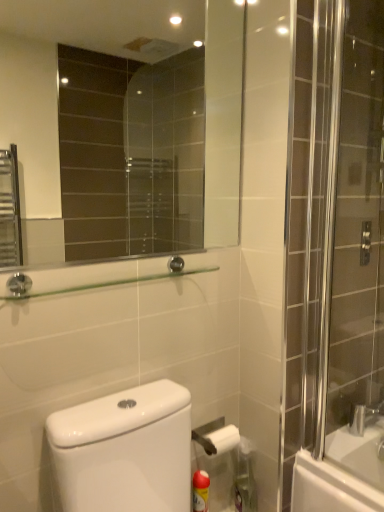
Locate an element on the screen. Image resolution: width=384 pixels, height=512 pixels. clear glass shelf at upper center is located at coordinates (110, 283).

Looking at this image, measure the distance between yellow plastic spray can at lower right, which is counted as the second cleaning product, starting from the left, and camera.

4.53 feet.

Identify the location of clear glass mirror at upper center. The image size is (384, 512). (133, 126).

Considering the sizes of clear glass shower door at right and clear glass mirror at upper center in the image, is clear glass shower door at right bigger or smaller than clear glass mirror at upper center?

A: clear glass shower door at right is bigger than clear glass mirror at upper center.

Considering the relative positions of clear glass shower door at right and clear glass mirror at upper center in the image provided, is clear glass shower door at right to the left or to the right of clear glass mirror at upper center?

In the image, clear glass shower door at right appears on the right side of clear glass mirror at upper center.

Considering the points (349, 44) and (15, 122), which point is behind, point (349, 44) or point (15, 122)?

The point (15, 122) is more distant.

Could you tell me if clear glass shower door at right is turned towards clear glass mirror at upper center?

No, clear glass shower door at right is not oriented towards clear glass mirror at upper center.

You are a GUI agent. You are given a task and a screenshot of the screen. Output one action in this format:
    pyautogui.click(x=<x>, y=<y>)
    Task: Click on the 1st cleaning product positioned below the clear glass shelf at upper center (from the image's perspective)
    The image size is (384, 512).
    Given the screenshot: What is the action you would take?
    pyautogui.click(x=245, y=478)

From the image's perspective, which object appears higher, yellow plastic spray can at lower right, positioned as the 1th cleaning product in right-to-left order, or clear glass shelf at upper center?

clear glass shelf at upper center, from the image's perspective.

Is the surface of yellow plastic spray can at lower right, which is counted as the second cleaning product, starting from the left, in direct contact with clear glass shelf at upper center?

yellow plastic spray can at lower right, which is counted as the second cleaning product, starting from the left, and clear glass shelf at upper center are clearly separated.

Is the position of yellow plastic spray can at lower right, which is counted as the second cleaning product, starting from the left, more distant than that of clear glass shelf at upper center?

Yes, the depth of yellow plastic spray can at lower right, which is counted as the second cleaning product, starting from the left, is greater than that of clear glass shelf at upper center.

Is clear glass mirror at upper center situated inside clear glass shelf at upper center or outside?

clear glass mirror at upper center is spatially situated outside clear glass shelf at upper center.

From the picture: Does clear glass mirror at upper center have a smaller size compared to clear glass shelf at upper center?

Actually, clear glass mirror at upper center might be larger than clear glass shelf at upper center.

Between point (138, 124) and point (8, 295), which one is positioned in front?

Point (8, 295)

Where is `balustrade below the clear glass mirror at upper center (from a real-world perspective)`? Image resolution: width=384 pixels, height=512 pixels. balustrade below the clear glass mirror at upper center (from a real-world perspective) is located at coordinates (110, 283).

From the image's perspective, which is above, clear glass shower door at right or clear glass shelf at upper center?

clear glass shower door at right.

In the scene shown: Looking at the image, does clear glass shower door at right seem bigger or smaller compared to clear glass shelf at upper center?

Considering their sizes, clear glass shower door at right takes up more space than clear glass shelf at upper center.

Is clear glass shower door at right in front of or behind clear glass shelf at upper center in the image?

clear glass shower door at right is behind clear glass shelf at upper center.

Which is behind, point (249, 490) or point (345, 219)?

The point (249, 490) is farther from the camera.

Is yellow plastic spray can at lower right, positioned as the 1th cleaning product in right-to-left order, positioned beyond the bounds of clear glass shower door at right?

That's correct, yellow plastic spray can at lower right, positioned as the 1th cleaning product in right-to-left order, is outside of clear glass shower door at right.

How different are the orientations of yellow plastic spray can at lower right, positioned as the 1th cleaning product in right-to-left order, and clear glass shower door at right in degrees?

There is a 90.3-degree angle between the facing directions of yellow plastic spray can at lower right, positioned as the 1th cleaning product in right-to-left order, and clear glass shower door at right.

Can you confirm if yellow plastic spray can at lower right, which is counted as the second cleaning product, starting from the left, is positioned to the right of clear glass shower door at right?

Incorrect, yellow plastic spray can at lower right, which is counted as the second cleaning product, starting from the left, is not on the right side of clear glass shower door at right.

Consider the image. Between yellow matte cleaning product at lower center, placed as the 1th cleaning product when sorted from left to right, and clear glass shower door at right, which one has less height?

yellow matte cleaning product at lower center, placed as the 1th cleaning product when sorted from left to right.

Is yellow matte cleaning product at lower center, the 2th cleaning product viewed from the right, with clear glass shower door at right?

There is a gap between yellow matte cleaning product at lower center, the 2th cleaning product viewed from the right, and clear glass shower door at right.

Is yellow matte cleaning product at lower center, placed as the 1th cleaning product when sorted from left to right, surrounding clear glass shower door at right?

No, clear glass shower door at right is located outside of yellow matte cleaning product at lower center, placed as the 1th cleaning product when sorted from left to right.

Is yellow matte cleaning product at lower center, placed as the 1th cleaning product when sorted from left to right, facing towards clear glass shower door at right?

No.

How distant is yellow matte cleaning product at lower center, placed as the 1th cleaning product when sorted from left to right, from clear glass mirror at upper center?

They are 6.91 feet apart.

From a real-world perspective, is yellow matte cleaning product at lower center, the 2th cleaning product viewed from the right, below clear glass mirror at upper center?

Yes, from a real-world perspective, yellow matte cleaning product at lower center, the 2th cleaning product viewed from the right, is below clear glass mirror at upper center.

Considering the sizes of yellow matte cleaning product at lower center, placed as the 1th cleaning product when sorted from left to right, and clear glass mirror at upper center in the image, is yellow matte cleaning product at lower center, placed as the 1th cleaning product when sorted from left to right, wider or thinner than clear glass mirror at upper center?

Considering their sizes, yellow matte cleaning product at lower center, placed as the 1th cleaning product when sorted from left to right, looks broader than clear glass mirror at upper center.

I want to click on mirror above the clear glass shower door at right (from a real-world perspective), so click(x=133, y=126).

Which cleaning product is the 2nd one when counting from the right side of the clear glass shelf at upper center? Please provide its 2D coordinates.

[(245, 478)]

Considering their positions, is clear glass shelf at upper center positioned further to yellow plastic spray can at lower right, which is counted as the second cleaning product, starting from the left, than clear glass mirror at upper center?

Based on the image, clear glass mirror at upper center appears to be further to yellow plastic spray can at lower right, which is counted as the second cleaning product, starting from the left.

From the image, which object appears to be nearer to yellow matte cleaning product at lower center, placed as the 1th cleaning product when sorted from left to right, clear glass shower door at right or clear glass mirror at upper center?

clear glass shower door at right is positioned closer to the anchor yellow matte cleaning product at lower center, placed as the 1th cleaning product when sorted from left to right.

Looking at the image, which one is located further to clear glass mirror at upper center, yellow plastic spray can at lower right, which is counted as the second cleaning product, starting from the left, or yellow matte cleaning product at lower center, the 2th cleaning product viewed from the right?

Based on the image, yellow matte cleaning product at lower center, the 2th cleaning product viewed from the right, appears to be further to clear glass mirror at upper center.

Considering their positions, is yellow plastic spray can at lower right, which is counted as the second cleaning product, starting from the left, positioned closer to clear glass shower door at right than yellow matte cleaning product at lower center, the 2th cleaning product viewed from the right?

yellow plastic spray can at lower right, which is counted as the second cleaning product, starting from the left.

Based on their spatial positions, is yellow matte cleaning product at lower center, placed as the 1th cleaning product when sorted from left to right, or clear glass shelf at upper center closer to clear glass mirror at upper center?

Among the two, clear glass shelf at upper center is located nearer to clear glass mirror at upper center.

Which object lies further to the anchor point clear glass mirror at upper center, yellow matte cleaning product at lower center, placed as the 1th cleaning product when sorted from left to right, or clear glass shower door at right?

Based on the image, yellow matte cleaning product at lower center, placed as the 1th cleaning product when sorted from left to right, appears to be further to clear glass mirror at upper center.

Considering their positions, is clear glass shelf at upper center positioned closer to yellow plastic spray can at lower right, which is counted as the second cleaning product, starting from the left, than clear glass shower door at right?

clear glass shower door at right lies closer to yellow plastic spray can at lower right, which is counted as the second cleaning product, starting from the left, than the other object.

Looking at the image, which one is located further to clear glass shower door at right, yellow plastic spray can at lower right, positioned as the 1th cleaning product in right-to-left order, or clear glass mirror at upper center?

clear glass mirror at upper center is further to clear glass shower door at right.

The width and height of the screenshot is (384, 512). Find the location of `balustrade between clear glass shower door at right and yellow matte cleaning product at lower center, the 2th cleaning product viewed from the right, in the vertical direction`. balustrade between clear glass shower door at right and yellow matte cleaning product at lower center, the 2th cleaning product viewed from the right, in the vertical direction is located at coordinates (110, 283).

Image resolution: width=384 pixels, height=512 pixels. In order to click on screen door that lies between clear glass mirror at upper center and yellow plastic spray can at lower right, which is counted as the second cleaning product, starting from the left, from top to bottom in this screenshot , I will do `click(353, 223)`.

The height and width of the screenshot is (512, 384). Find the location of `cleaning product between clear glass shelf at upper center and yellow matte cleaning product at lower center, placed as the 1th cleaning product when sorted from left to right, from top to bottom`. cleaning product between clear glass shelf at upper center and yellow matte cleaning product at lower center, placed as the 1th cleaning product when sorted from left to right, from top to bottom is located at coordinates (245, 478).

Find the location of a particular element. balustrade that lies between clear glass mirror at upper center and yellow matte cleaning product at lower center, placed as the 1th cleaning product when sorted from left to right, from top to bottom is located at coordinates (x=110, y=283).